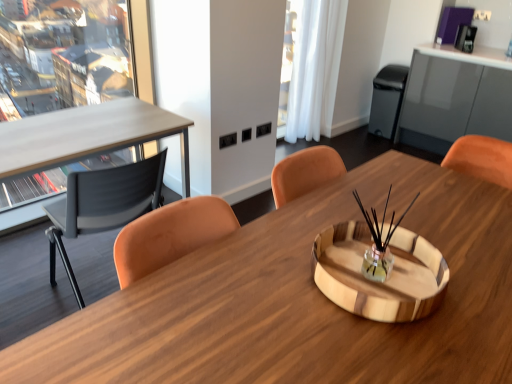
Question: Is wooden desk at center inside white sheer curtain at upper right?

Choices:
 (A) yes
 (B) no

Answer: (B)

Question: Would you say white sheer curtain at upper right is a long distance from wooden desk at center?

Choices:
 (A) yes
 (B) no

Answer: (A)

Question: From a real-world perspective, does white sheer curtain at upper right sit lower than wooden desk at center?

Choices:
 (A) no
 (B) yes

Answer: (A)

Question: Would you say white sheer curtain at upper right is outside wooden desk at center?

Choices:
 (A) no
 (B) yes

Answer: (B)

Question: Can you confirm if white sheer curtain at upper right is positioned to the right of wooden desk at center?

Choices:
 (A) no
 (B) yes

Answer: (B)

Question: Is matte black chair at left to the left or to the right of wooden desk at center in the image?

Choices:
 (A) right
 (B) left

Answer: (B)

Question: Based on their sizes in the image, would you say matte black chair at left is bigger or smaller than wooden desk at center?

Choices:
 (A) small
 (B) big

Answer: (A)

Question: Considering the positions of matte black chair at left and wooden desk at center in the image, is matte black chair at left taller or shorter than wooden desk at center?

Choices:
 (A) tall
 (B) short

Answer: (A)

Question: From a real-world perspective, is matte black chair at left physically located above or below wooden desk at center?

Choices:
 (A) above
 (B) below

Answer: (A)

Question: From a real-world perspective, is white sheer curtain at upper right physically located above or below wooden desk at center?

Choices:
 (A) below
 (B) above

Answer: (B)

Question: Is white sheer curtain at upper right taller or shorter than wooden desk at center?

Choices:
 (A) short
 (B) tall

Answer: (B)

Question: Is point click(328, 33) positioned closer to the camera than point click(30, 370)?

Choices:
 (A) closer
 (B) farther

Answer: (B)

Question: Do you think white sheer curtain at upper right is within wooden desk at center, or outside of it?

Choices:
 (A) outside
 (B) inside

Answer: (A)

Question: Is black matte trash bin/can at right in front of or behind white sheer curtain at upper right in the image?

Choices:
 (A) behind
 (B) front

Answer: (A)

Question: From a real-world perspective, is black matte trash bin/can at right physically located above or below white sheer curtain at upper right?

Choices:
 (A) below
 (B) above

Answer: (A)